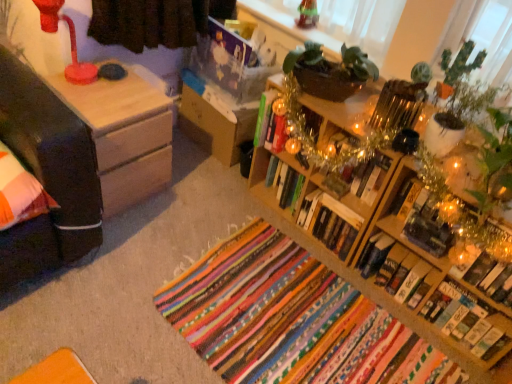
This screenshot has height=384, width=512. I want to click on free space to the left of hardcover book at center-right, the 2th book viewed from the left, so click(288, 238).